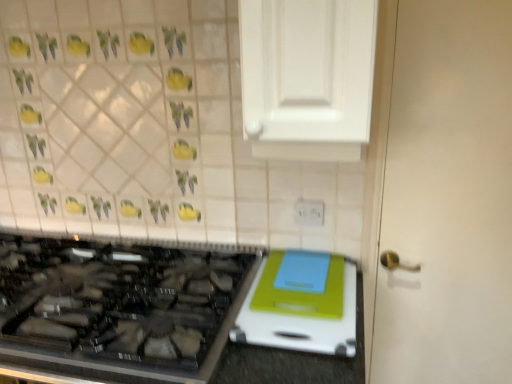
Question: Is white plastic electric outlet at upper center far from white glossy cabinet at upper center?

Choices:
 (A) no
 (B) yes

Answer: (A)

Question: From the image's perspective, is white plastic electric outlet at upper center beneath white glossy cabinet at upper center?

Choices:
 (A) yes
 (B) no

Answer: (A)

Question: Does white plastic electric outlet at upper center appear on the left side of white glossy cabinet at upper center?

Choices:
 (A) no
 (B) yes

Answer: (A)

Question: Does white plastic electric outlet at upper center appear on the right side of white glossy cabinet at upper center?

Choices:
 (A) yes
 (B) no

Answer: (A)

Question: Is white plastic electric outlet at upper center shorter than white glossy cabinet at upper center?

Choices:
 (A) no
 (B) yes

Answer: (B)

Question: Is white plastic electric outlet at upper center bigger than white glossy cabinet at upper center?

Choices:
 (A) no
 (B) yes

Answer: (A)

Question: From a real-world perspective, is white matte door at right on white plastic electric outlet at upper center?

Choices:
 (A) yes
 (B) no

Answer: (B)

Question: Is white plastic electric outlet at upper center inside white matte door at right?

Choices:
 (A) no
 (B) yes

Answer: (A)

Question: From the image's perspective, does white matte door at right appear lower than white plastic electric outlet at upper center?

Choices:
 (A) no
 (B) yes

Answer: (B)

Question: Considering the relative positions of white matte door at right and white plastic electric outlet at upper center in the image provided, is white matte door at right to the right of white plastic electric outlet at upper center from the viewer's perspective?

Choices:
 (A) yes
 (B) no

Answer: (A)

Question: Is white matte door at right oriented towards white plastic electric outlet at upper center?

Choices:
 (A) no
 (B) yes

Answer: (A)

Question: Is white matte door at right beside white plastic electric outlet at upper center?

Choices:
 (A) yes
 (B) no

Answer: (B)

Question: Is white plastic electric outlet at upper center taller than white matte door at right?

Choices:
 (A) yes
 (B) no

Answer: (B)